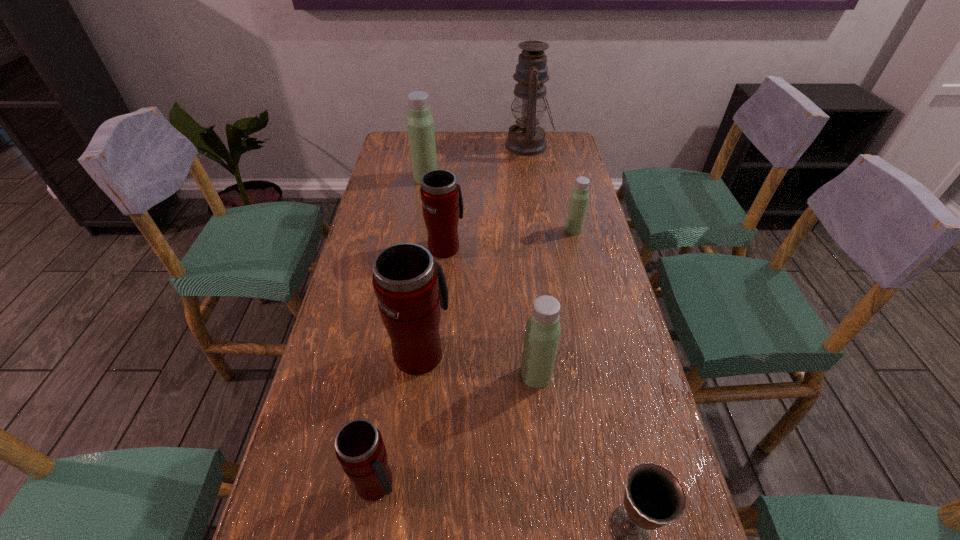
Select which thermos bottle is the third closest to the farthest red thermos bottle. Please provide its 2D coordinates. Your answer should be formatted as a tuple, i.e. [(x, y)], where the tuple contains the x and y coordinates of a point satisfying the conditions above.

[(579, 197)]

Select which thermos bottle is the third closest to the nearest light thermos bottle. Please provide its 2D coordinates. Your answer should be formatted as a tuple, i.e. [(x, y)], where the tuple contains the x and y coordinates of a point satisfying the conditions above.

[(442, 203)]

Find the location of `the third closest light thermos bottle to the second smallest red thermos bottle`. the third closest light thermos bottle to the second smallest red thermos bottle is located at coordinates (542, 333).

Where is `light thermos bottle that stands as the third closest to the biggest red thermos bottle`? Image resolution: width=960 pixels, height=540 pixels. light thermos bottle that stands as the third closest to the biggest red thermos bottle is located at coordinates (421, 131).

Locate which red thermos bottle is the closest to the second thermos bottle from right to left. Please provide its 2D coordinates. Your answer should be formatted as a tuple, i.e. [(x, y)], where the tuple contains the x and y coordinates of a point satisfying the conditions above.

[(410, 286)]

Locate which red thermos bottle is the third closest to the oil lamp. Please provide its 2D coordinates. Your answer should be formatted as a tuple, i.e. [(x, y)], where the tuple contains the x and y coordinates of a point satisfying the conditions above.

[(359, 447)]

Where is `vacant space that satisfies the following two spatial constraints: 1. on the side with the handle of the biggest red thermos bottle; 2. on the left side of the brown oil lamp`? The height and width of the screenshot is (540, 960). vacant space that satisfies the following two spatial constraints: 1. on the side with the handle of the biggest red thermos bottle; 2. on the left side of the brown oil lamp is located at coordinates (444, 145).

Image resolution: width=960 pixels, height=540 pixels. I want to click on blank space that satisfies the following two spatial constraints: 1. on the front side of the leftmost light thermos bottle; 2. on the right side of the smallest light thermos bottle, so click(418, 230).